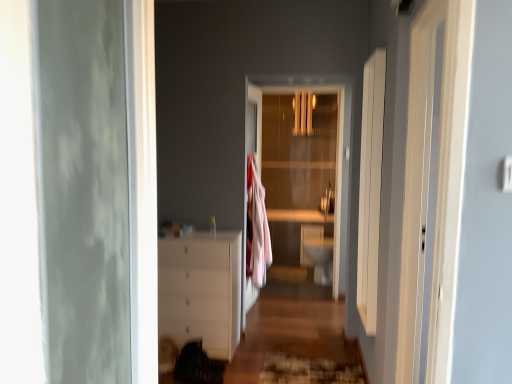
Question: Is white glossy chest of drawers at center closer to the viewer compared to white glossy toilet bowl at center?

Choices:
 (A) no
 (B) yes

Answer: (B)

Question: Can white glossy toilet bowl at center be found inside white glossy chest of drawers at center?

Choices:
 (A) yes
 (B) no

Answer: (B)

Question: Could you tell me if white glossy chest of drawers at center is turned towards white glossy toilet bowl at center?

Choices:
 (A) no
 (B) yes

Answer: (A)

Question: Is the depth of white glossy chest of drawers at center greater than that of white glossy toilet bowl at center?

Choices:
 (A) yes
 (B) no

Answer: (B)

Question: From the image's perspective, is white glossy chest of drawers at center on top of white glossy toilet bowl at center?

Choices:
 (A) yes
 (B) no

Answer: (A)

Question: Is white glossy chest of drawers at center bigger than white glossy toilet bowl at center?

Choices:
 (A) no
 (B) yes

Answer: (B)

Question: Is textured brown rug at lower center positioned far away from white glossy chest of drawers at center?

Choices:
 (A) yes
 (B) no

Answer: (B)

Question: From the image's perspective, is textured brown rug at lower center under white glossy chest of drawers at center?

Choices:
 (A) yes
 (B) no

Answer: (A)

Question: Could you tell me if textured brown rug at lower center is facing white glossy chest of drawers at center?

Choices:
 (A) yes
 (B) no

Answer: (B)

Question: Is textured brown rug at lower center smaller than white glossy chest of drawers at center?

Choices:
 (A) no
 (B) yes

Answer: (B)

Question: From a real-world perspective, is textured brown rug at lower center beneath white glossy chest of drawers at center?

Choices:
 (A) yes
 (B) no

Answer: (A)

Question: Is textured brown rug at lower center at the left side of white glossy chest of drawers at center?

Choices:
 (A) yes
 (B) no

Answer: (B)

Question: Considering the relative sizes of white glossy toilet bowl at center and transparent glass door at center in the image provided, is white glossy toilet bowl at center bigger than transparent glass door at center?

Choices:
 (A) yes
 (B) no

Answer: (B)